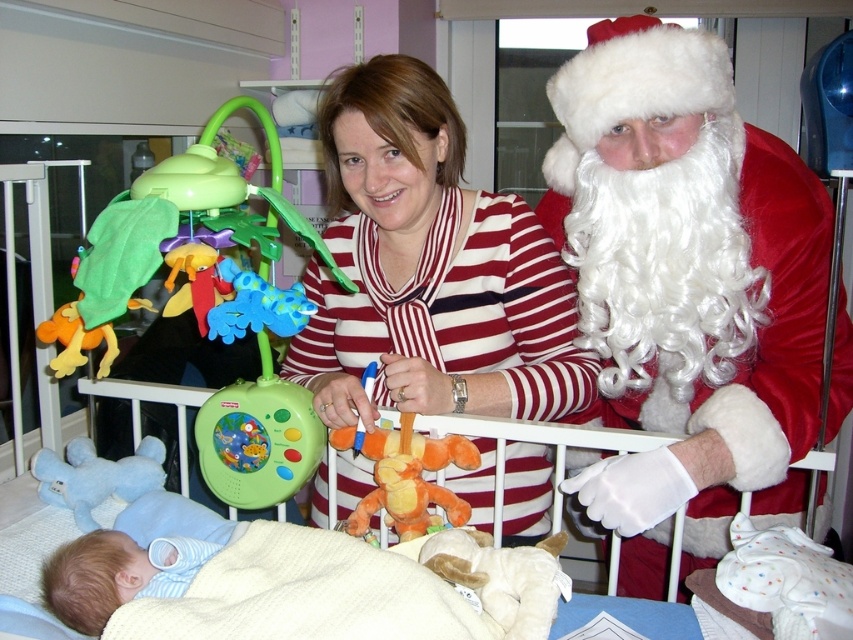
You are a nurse in the hospital and need to choose a toy for the baby in the crib. The fluffy white teddy bear at center and the plush orange monkey at center are available. Which toy is smaller and more appropriate for the baby to hold?

The fluffy white teddy bear at center is smaller than the plush orange monkey at center, so it is more appropriate for the baby to hold.

You are a nurse in the hospital room and want to retrieve the fluffy white teddy bear at center and the plush orange monkey at center for the baby. Which toy is located lower in the crib?

The fluffy white teddy bear at center is located lower than the plush orange monkey at center in the crib.

You are a nurse in the hospital nursery and need to store the light blue cotton swaddle at lower left and the light blue plush bear at lower left in a drawer. The drawer has a height limit of 15 cm. Can both items fit vertically without bending or folding them?

The light blue cotton swaddle at lower left is smaller than the light blue plush bear at lower left. Since the drawer has a height limit of 15 cm, both items can fit vertically as the cotton swaddle is smaller and the plush bear likely does not exceed the height limit.